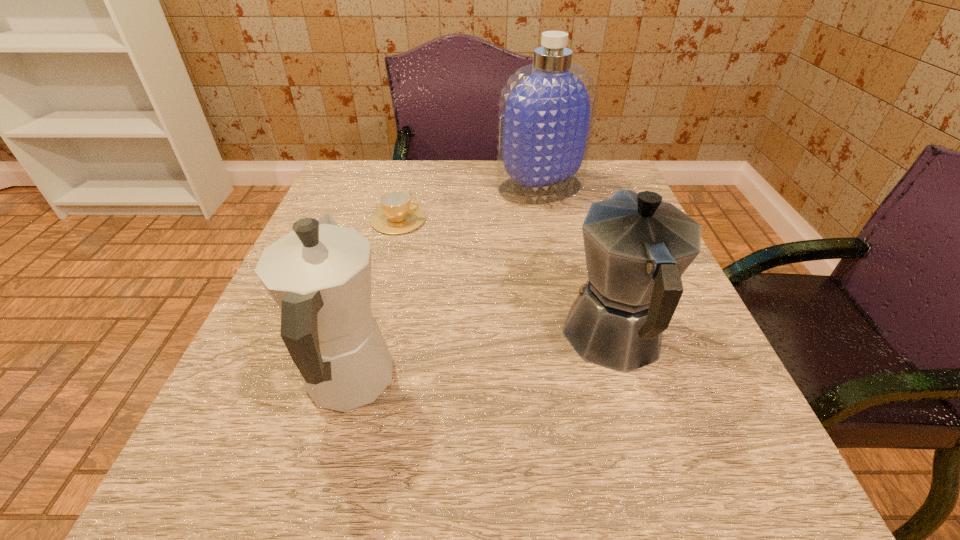
Locate an element on the screen. This screenshot has width=960, height=540. free spot at the left edge of the desktop is located at coordinates (360, 220).

Image resolution: width=960 pixels, height=540 pixels. Identify the location of free space at the right edge of the desktop. (684, 428).

The image size is (960, 540). What are the coordinates of `vacant area at the far left corner` in the screenshot? It's located at (371, 180).

At what (x,y) coordinates should I click in order to perform the action: click on vacant space at the near left corner of the desktop. Please return your answer as a coordinate pair (x, y). Image resolution: width=960 pixels, height=540 pixels. Looking at the image, I should click on (227, 465).

Where is `vacant space at the far right corner of the desktop`? This screenshot has width=960, height=540. vacant space at the far right corner of the desktop is located at coordinates (606, 194).

Where is `free space that is in between the cup and the right coffeepot`? The image size is (960, 540). free space that is in between the cup and the right coffeepot is located at coordinates (506, 279).

The width and height of the screenshot is (960, 540). What are the coordinates of `unoccupied area between the cup and the right coffeepot` in the screenshot? It's located at (506, 279).

The image size is (960, 540). I want to click on free space that is in between the left coffeepot and the right coffeepot, so click(482, 361).

Identify the location of blank region between the left coffeepot and the cleansing agent. This screenshot has height=540, width=960. (444, 285).

The image size is (960, 540). Identify the location of free space between the left coffeepot and the cleansing agent. (444, 285).